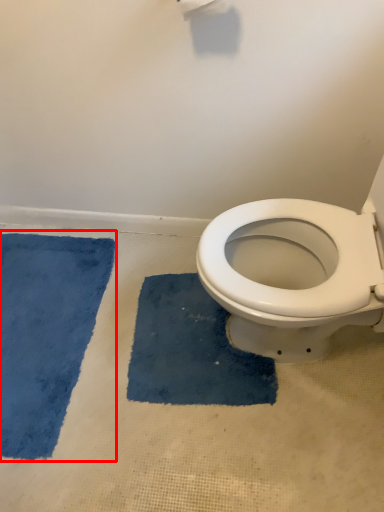
Question: From the image's perspective, where is bath mat (annotated by the red box) located relative to bath mat?

Choices:
 (A) below
 (B) above

Answer: (B)